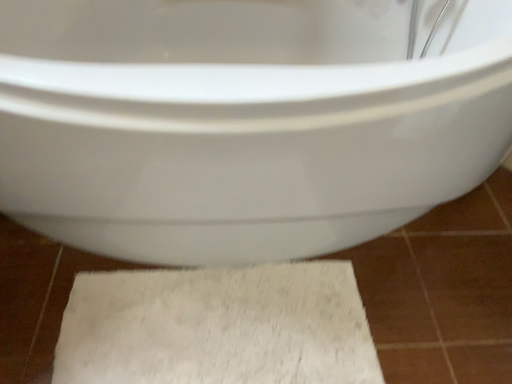
The height and width of the screenshot is (384, 512). Describe the element at coordinates (218, 327) in the screenshot. I see `white fluffy bath mat at lower center` at that location.

Locate an element on the screen. This screenshot has width=512, height=384. white fluffy bath mat at lower center is located at coordinates (218, 327).

What is the approximate width of white fluffy bath mat at lower center?

The width of white fluffy bath mat at lower center is 13.70 inches.

What do you see at coordinates (243, 123) in the screenshot?
I see `white glossy toilet at center` at bounding box center [243, 123].

You are a GUI agent. You are given a task and a screenshot of the screen. Output one action in this format:
    pyautogui.click(x=<x>, y=<y>)
    Task: Click on the white glossy toilet at center
    
    Given the screenshot: What is the action you would take?
    pyautogui.click(x=243, y=123)

Find the location of `white fluffy bath mat at lower center`. white fluffy bath mat at lower center is located at coordinates coord(218,327).

Which object is positioned more to the right, white glossy toilet at center or white fluffy bath mat at lower center?

white glossy toilet at center is more to the right.

Which object is closer to the camera, white glossy toilet at center or white fluffy bath mat at lower center?

white glossy toilet at center is more forward.

Which is nearer, (270, 107) or (207, 345)?

Point (270, 107) is positioned closer to the camera compared to point (207, 345).

From the image's perspective, is white glossy toilet at center below white fluffy bath mat at lower center?

Incorrect, from the image's perspective, white glossy toilet at center is higher than white fluffy bath mat at lower center.

From a real-world perspective, which object stands above the other?

white glossy toilet at center is physically above.

Which of these two, white glossy toilet at center or white fluffy bath mat at lower center, is thinner?

white fluffy bath mat at lower center.

Does white glossy toilet at center have a lesser height compared to white fluffy bath mat at lower center?

No, white glossy toilet at center is not shorter than white fluffy bath mat at lower center.

Does white glossy toilet at center have a larger size compared to white fluffy bath mat at lower center?

Indeed, white glossy toilet at center has a larger size compared to white fluffy bath mat at lower center.

Is white glossy toilet at center positioned beyond the bounds of white fluffy bath mat at lower center?

Absolutely, white glossy toilet at center is external to white fluffy bath mat at lower center.

Are white glossy toilet at center and white fluffy bath mat at lower center far apart?

No, white glossy toilet at center is in close proximity to white fluffy bath mat at lower center.

Is white glossy toilet at center oriented towards white fluffy bath mat at lower center?

No, white glossy toilet at center is not aimed at white fluffy bath mat at lower center.

How different are the orientations of white glossy toilet at center and white fluffy bath mat at lower center in degrees?

They differ by 46.6 degrees in their facing directions.

How distant is white glossy toilet at center from white fluffy bath mat at lower center?

A distance of 14.83 inches exists between white glossy toilet at center and white fluffy bath mat at lower center.

Where is `bath mat located underneath the white glossy toilet at center (from a real-world perspective)`? This screenshot has height=384, width=512. bath mat located underneath the white glossy toilet at center (from a real-world perspective) is located at coordinates (218, 327).

Considering the positions of objects white fluffy bath mat at lower center and white glossy toilet at center in the image provided, who is more to the left, white fluffy bath mat at lower center or white glossy toilet at center?

Positioned to the left is white fluffy bath mat at lower center.

Which is in front, white fluffy bath mat at lower center or white glossy toilet at center?

white glossy toilet at center.

Considering the positions of points (185, 342) and (283, 78), is point (185, 342) closer to camera compared to point (283, 78)?

No, (185, 342) is further to viewer.

From the image's perspective, is white fluffy bath mat at lower center on top of white glossy toilet at center?

No, from the image's perspective, white fluffy bath mat at lower center is not over white glossy toilet at center.

From a real-world perspective, which object rests below the other?

white fluffy bath mat at lower center, from a real-world perspective.

Considering the sizes of white fluffy bath mat at lower center and white glossy toilet at center in the image, is white fluffy bath mat at lower center wider or thinner than white glossy toilet at center?

In the image, white fluffy bath mat at lower center appears to be more narrow than white glossy toilet at center.

From their relative heights in the image, would you say white fluffy bath mat at lower center is taller or shorter than white glossy toilet at center?

white fluffy bath mat at lower center is shorter than white glossy toilet at center.

Can you confirm if white fluffy bath mat at lower center is bigger than white glossy toilet at center?

No, white fluffy bath mat at lower center is not bigger than white glossy toilet at center.

Is white fluffy bath mat at lower center inside or outside of white glossy toilet at center?

white fluffy bath mat at lower center lies within the bounds of white glossy toilet at center.

Looking at this image, is white fluffy bath mat at lower center placed right next to white glossy toilet at center?

No, white fluffy bath mat at lower center is not touching white glossy toilet at center.

Is white fluffy bath mat at lower center oriented towards white glossy toilet at center?

Yes, white fluffy bath mat at lower center faces towards white glossy toilet at center.

In the image, there is a white glossy toilet at center. What are the coordinates of `bath mat below it (from the image's perspective)` in the screenshot? It's located at (218, 327).

Where is `toilet above the white fluffy bath mat at lower center (from the image's perspective)`? The width and height of the screenshot is (512, 384). toilet above the white fluffy bath mat at lower center (from the image's perspective) is located at coordinates (243, 123).

Locate an element on the screen. This screenshot has height=384, width=512. bath mat below the white glossy toilet at center (from the image's perspective) is located at coordinates (218, 327).